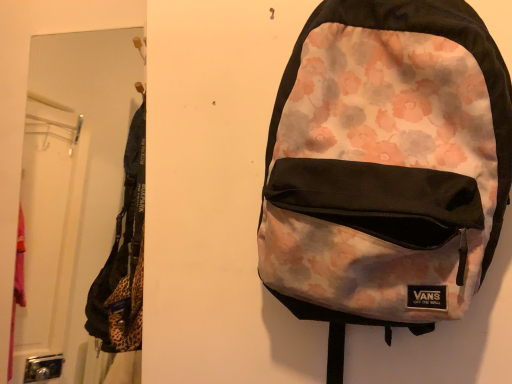
Image resolution: width=512 pixels, height=384 pixels. I want to click on metallic silver mirror at left, so click(x=72, y=187).

This screenshot has width=512, height=384. What do you see at coordinates (72, 187) in the screenshot? I see `metallic silver mirror at left` at bounding box center [72, 187].

Find the location of a particular element. The width and height of the screenshot is (512, 384). floral-patterned fabric backpack at center is located at coordinates (379, 174).

Describe the element at coordinates (379, 174) in the screenshot. I see `floral-patterned fabric backpack at center` at that location.

Where is `metallic silver mirror at left`? metallic silver mirror at left is located at coordinates (72, 187).

Considering the positions of objects metallic silver mirror at left and floral-patterned fabric backpack at center in the image provided, who is more to the left, metallic silver mirror at left or floral-patterned fabric backpack at center?

metallic silver mirror at left.

Relative to floral-patterned fabric backpack at center, is metallic silver mirror at left in front or behind?

Clearly, metallic silver mirror at left is behind floral-patterned fabric backpack at center.

Is point (95, 105) positioned after point (351, 186)?

Yes, it is.

From the image's perspective, is metallic silver mirror at left positioned above or below floral-patterned fabric backpack at center?

Based on their image positions, metallic silver mirror at left is located above floral-patterned fabric backpack at center.

From a real-world perspective, is metallic silver mirror at left below floral-patterned fabric backpack at center?

No, from a real-world perspective, metallic silver mirror at left is not under floral-patterned fabric backpack at center.

Considering the relative sizes of metallic silver mirror at left and floral-patterned fabric backpack at center in the image provided, is metallic silver mirror at left wider than floral-patterned fabric backpack at center?

Yes.

Who is shorter, metallic silver mirror at left or floral-patterned fabric backpack at center?

With less height is floral-patterned fabric backpack at center.

Does metallic silver mirror at left have a larger size compared to floral-patterned fabric backpack at center?

Yes.

Is metallic silver mirror at left inside or outside of floral-patterned fabric backpack at center?

metallic silver mirror at left is not enclosed by floral-patterned fabric backpack at center.

Is metallic silver mirror at left next to floral-patterned fabric backpack at center?

There is a gap between metallic silver mirror at left and floral-patterned fabric backpack at center.

In the scene shown: Could you tell me if metallic silver mirror at left is turned towards floral-patterned fabric backpack at center?

No, metallic silver mirror at left does not turn towards floral-patterned fabric backpack at center.

How many degrees apart are the facing directions of metallic silver mirror at left and floral-patterned fabric backpack at center?

1.31 degrees.

Measure the distance between metallic silver mirror at left and floral-patterned fabric backpack at center.

1.37 meters.

Where is `mirror lying behind the floral-patterned fabric backpack at center`? The width and height of the screenshot is (512, 384). mirror lying behind the floral-patterned fabric backpack at center is located at coordinates (72, 187).

Would you say floral-patterned fabric backpack at center is to the left or to the right of metallic silver mirror at left in the picture?

floral-patterned fabric backpack at center is to the right of metallic silver mirror at left.

Consider the image. Is the position of floral-patterned fabric backpack at center more distant than that of metallic silver mirror at left?

No, it is in front of metallic silver mirror at left.

Which point is more distant from viewer, (411, 236) or (109, 91)?

Point (109, 91)

From the image's perspective, does floral-patterned fabric backpack at center appear higher than metallic silver mirror at left?

No, from the image's perspective, floral-patterned fabric backpack at center is not above metallic silver mirror at left.

From a real-world perspective, is floral-patterned fabric backpack at center on metallic silver mirror at left?

No, from a real-world perspective, floral-patterned fabric backpack at center is not above metallic silver mirror at left.

Can you confirm if floral-patterned fabric backpack at center is wider than metallic silver mirror at left?

No, floral-patterned fabric backpack at center is not wider than metallic silver mirror at left.

In the scene shown: Considering the relative sizes of floral-patterned fabric backpack at center and metallic silver mirror at left in the image provided, is floral-patterned fabric backpack at center taller than metallic silver mirror at left?

No, floral-patterned fabric backpack at center is not taller than metallic silver mirror at left.

Considering the sizes of floral-patterned fabric backpack at center and metallic silver mirror at left in the image, is floral-patterned fabric backpack at center bigger or smaller than metallic silver mirror at left?

In the image, floral-patterned fabric backpack at center appears to be smaller than metallic silver mirror at left.

Would you say metallic silver mirror at left is part of floral-patterned fabric backpack at center's contents?

Definitely not — metallic silver mirror at left is not inside floral-patterned fabric backpack at center.

Is floral-patterned fabric backpack at center not close to metallic silver mirror at left?

Yes, floral-patterned fabric backpack at center is far from metallic silver mirror at left.

Is floral-patterned fabric backpack at center positioned with its back to metallic silver mirror at left?

No, floral-patterned fabric backpack at center is not facing away from metallic silver mirror at left.

How different are the orientations of floral-patterned fabric backpack at center and metallic silver mirror at left in degrees?

1.31 degrees separate the facing orientations of floral-patterned fabric backpack at center and metallic silver mirror at left.

How far apart are floral-patterned fabric backpack at center and metallic silver mirror at left?

4.48 feet.

Find the location of a particular element. mirror positioned vertically above the floral-patterned fabric backpack at center (from a real-world perspective) is located at coordinates [x=72, y=187].

The width and height of the screenshot is (512, 384). I want to click on mirror behind the floral-patterned fabric backpack at center, so click(72, 187).

Where is `backpack below the metallic silver mirror at left (from the image's perspective)`? This screenshot has width=512, height=384. backpack below the metallic silver mirror at left (from the image's perspective) is located at coordinates (379, 174).